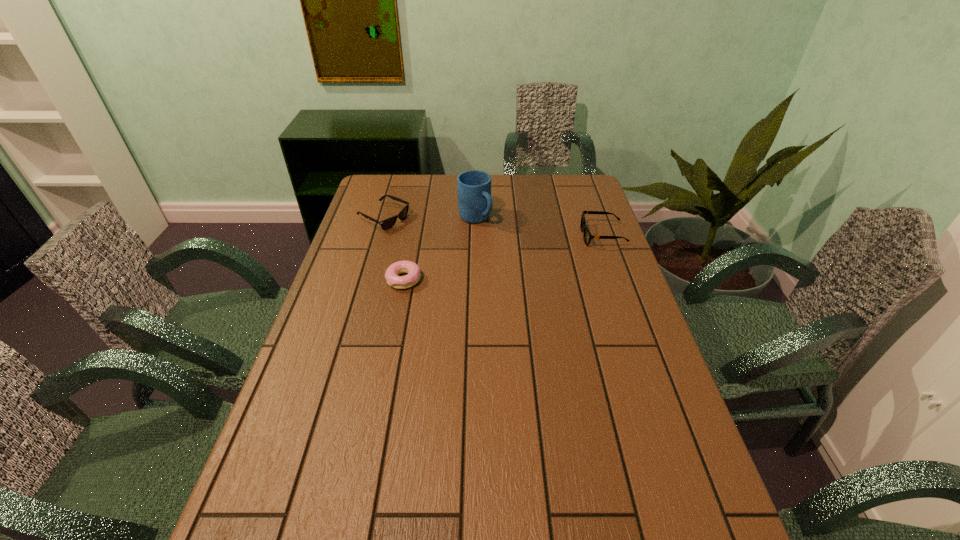
Image resolution: width=960 pixels, height=540 pixels. In order to click on doughnut in this screenshot , I will do 414,273.

The image size is (960, 540). Identify the location of the nearest object. (414, 273).

The image size is (960, 540). Find the location of `the rightmost object`. the rightmost object is located at coordinates (587, 236).

Locate an element on the screen. The height and width of the screenshot is (540, 960). mug is located at coordinates click(475, 203).

Identify the location of the tallest object. pyautogui.click(x=475, y=203).

Locate an element on the screen. The image size is (960, 540). the left sunglasses is located at coordinates click(386, 224).

Find the location of `blank area located 0.100m on the right of the shortest object`. blank area located 0.100m on the right of the shortest object is located at coordinates (454, 280).

Locate an element on the screen. This screenshot has width=960, height=540. blank area located 0.080m on the front-facing side of the rightmost object is located at coordinates (558, 236).

Where is `vacant region located 0.340m on the front-facing side of the rightmost object`? The height and width of the screenshot is (540, 960). vacant region located 0.340m on the front-facing side of the rightmost object is located at coordinates (483, 236).

Where is `free space located 0.190m on the front-facing side of the rightmost object`? The width and height of the screenshot is (960, 540). free space located 0.190m on the front-facing side of the rightmost object is located at coordinates coord(526,236).